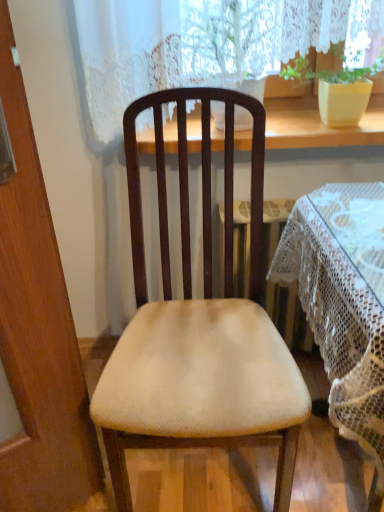
Find the location of a particular element. This screenshot has width=384, height=512. free space to the left of matte yellow pot at upper right is located at coordinates (292, 126).